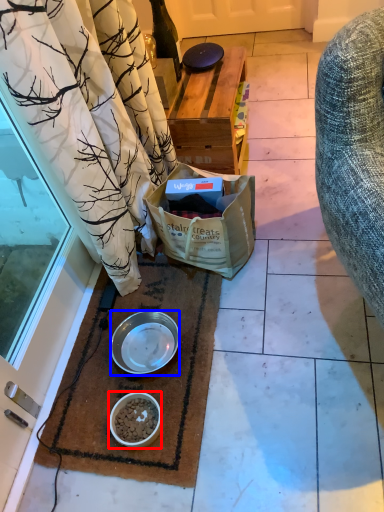
Question: Which point is further to the camera, bowl (highlighted by a red box) or bowl (highlighted by a blue box)?

Choices:
 (A) bowl
 (B) bowl

Answer: (B)